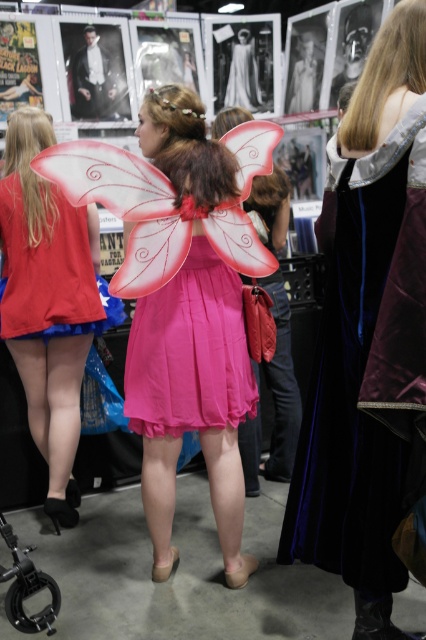
Is velvet black dress at center taller than matte red dress at center?

Indeed, velvet black dress at center has a greater height compared to matte red dress at center.

Identify the location of velvet black dress at center. (362, 364).

What are the coordinates of `velvet black dress at center` in the screenshot? It's located at pos(362,364).

Does pink fabric dress at center have a larger size compared to black plastic baby carriage at lower left?

Yes.

How much distance is there between pink fabric dress at center and black plastic baby carriage at lower left?

They are 25.52 inches apart.

Which is behind, point (198, 387) or point (5, 540)?

The point (198, 387) is more distant.

What are the coordinates of `pink fabric dress at center` in the screenshot? It's located at (190, 340).

Is point (181, 442) positioned in front of point (172, 307)?

That is False.

Between pink fabric dress at center and pink satin dress at center, which one is positioned lower?

Positioned lower is pink fabric dress at center.

Does point (196, 196) come in front of point (152, 388)?

Yes, point (196, 196) is closer to viewer.

I want to click on pink fabric dress at center, so click(190, 340).